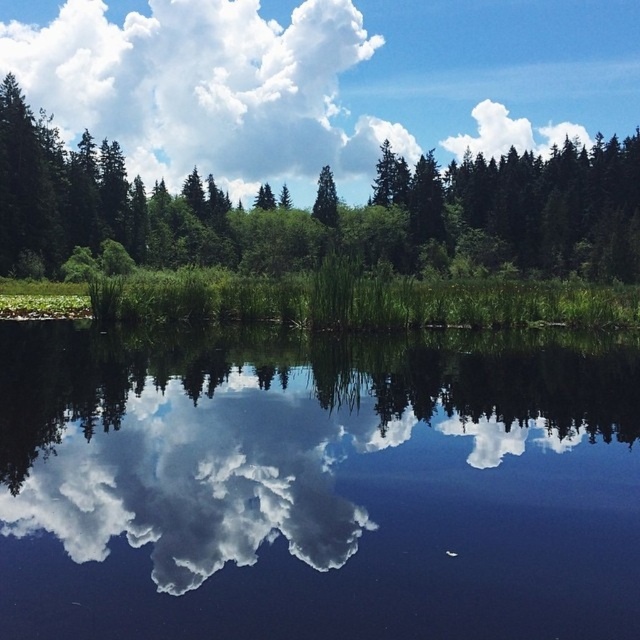
You are a painter standing at the edge of the water. You want to paint the scene so that the transparent water at center and the green matte tree at center are both visible. Which object should you paint first to ensure proper perspective?

You should paint the green matte tree at center first because it is closer to the viewer than the transparent water at center, allowing you to layer the water behind it for proper perspective.

You are standing at the edge of the water and want to place a small floating decoration exactly at the center of the transparent water at center. According to the coordinates provided, where should you position it?

The transparent water at center should be positioned at coordinates point (317, 488) as specified.

You are standing at the edge of the water and see the transparent water at center and the green leafy trees at upper center. Which object is closer to you?

The transparent water at center is closer to you than the green leafy trees at upper center because it is positioned below them.